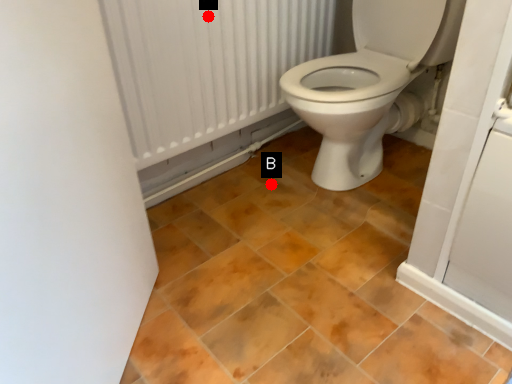
Question: Two points are circled on the image, labeled by A and B beside each circle. Which point is farther to the camera?

Choices:
 (A) A is further
 (B) B is further

Answer: (B)